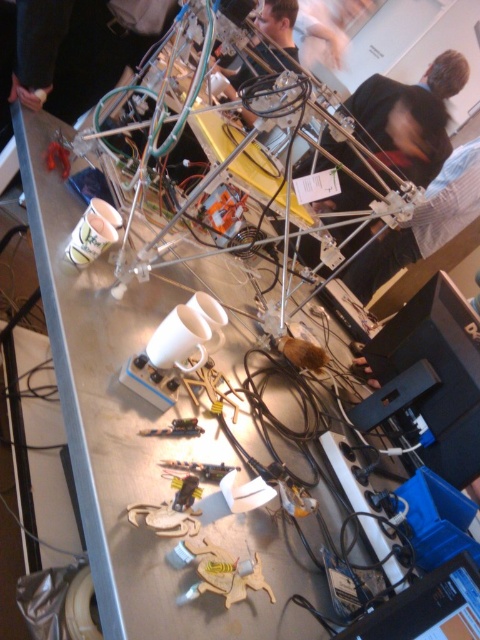
You are a visitor in the workshop and want to locate the matte black laptop at upper left and the matte black person at upper center. From your perspective, which object is positioned lower?

The matte black laptop at upper left is positioned below the matte black person at upper center, so the laptop is lower.

In the scene shown: You are a visitor observing the workspace and need to determine the relative heights of the objects in the scene. Which object is shorter between the matte black laptop at upper left and the matte black person at upper center?

The matte black laptop at upper left is shorter than the matte black person at upper center.

You are standing in a workshop and see the matte black laptop at upper left. If you want to pick it up without moving from your current position, is it within your reach?

The matte black laptop at upper left is 4.04 feet away from viewer, which is approximately 48.5 inches. Since the average human arm length is around 25 to 30 inches, you cannot reach it without moving closer.